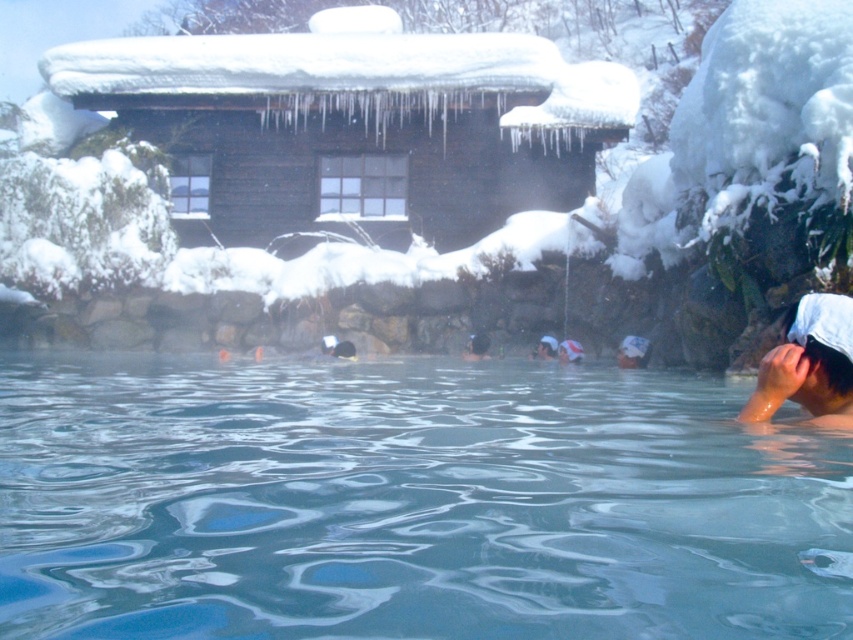
You are a photographer standing at the edge of the clear water at center. You want to take a photo of the white cloth headband at lower right. Will the headband be visible above the waterline?

The clear water at center is not as tall as the white cloth headband at lower right, so the headband will be visible above the waterline.

You are standing at the entrance of the rustic wooden building in the background of the winter onsen scene. You want to walk directly to the clear water at center. What direction should you head towards?

Since the clear water at center is located at point 0.787 on the x axis and 0.479 on the y axis, you should head towards the lower right direction from the entrance to reach it.